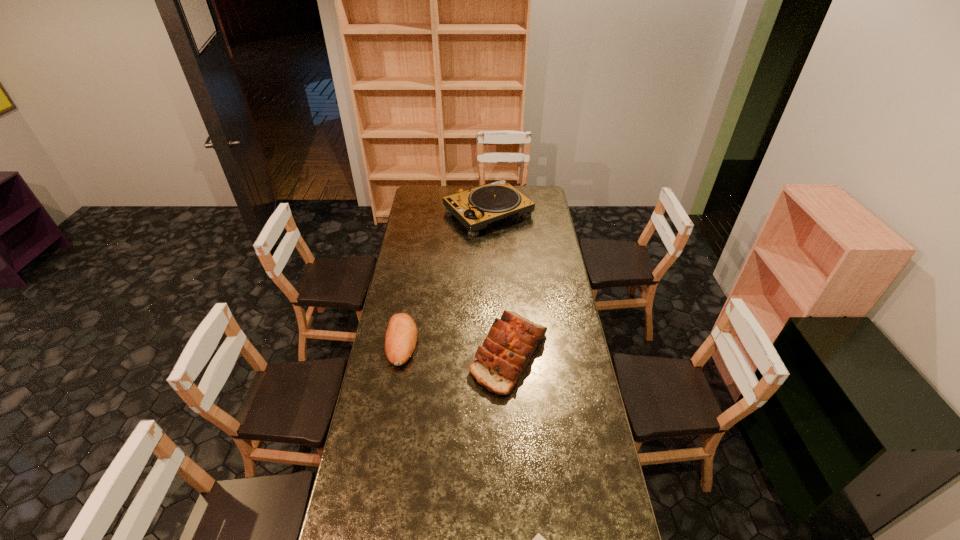
Identify the location of object identified as the third closest to the record player. This screenshot has width=960, height=540. (537, 539).

Locate an element on the screen. Image resolution: width=960 pixels, height=540 pixels. object that is the closest to the diary is located at coordinates (511, 341).

The width and height of the screenshot is (960, 540). I want to click on free space that satisfies the following two spatial constraints: 1. on the back side of the shorter bread; 2. on the right side of the record player, so click(x=424, y=213).

You are a GUI agent. You are given a task and a screenshot of the screen. Output one action in this format:
    pyautogui.click(x=<x>, y=<y>)
    Task: Click on the free space that satisfies the following two spatial constraints: 1. on the front side of the farthest object; 2. on the left side of the taller bread
    The width and height of the screenshot is (960, 540).
    Given the screenshot: What is the action you would take?
    pyautogui.click(x=492, y=354)